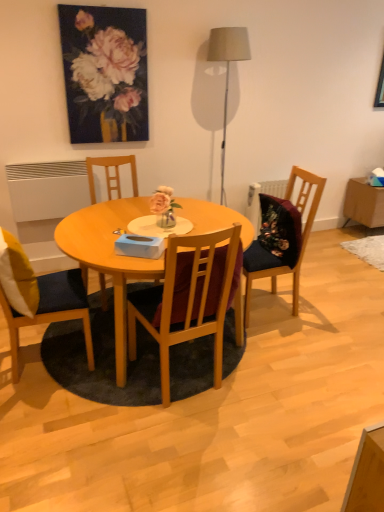
Locate an element on the screen. vacant space to the right of dark blue fabric chair at center, acting as the first chair starting from the right is located at coordinates (328, 308).